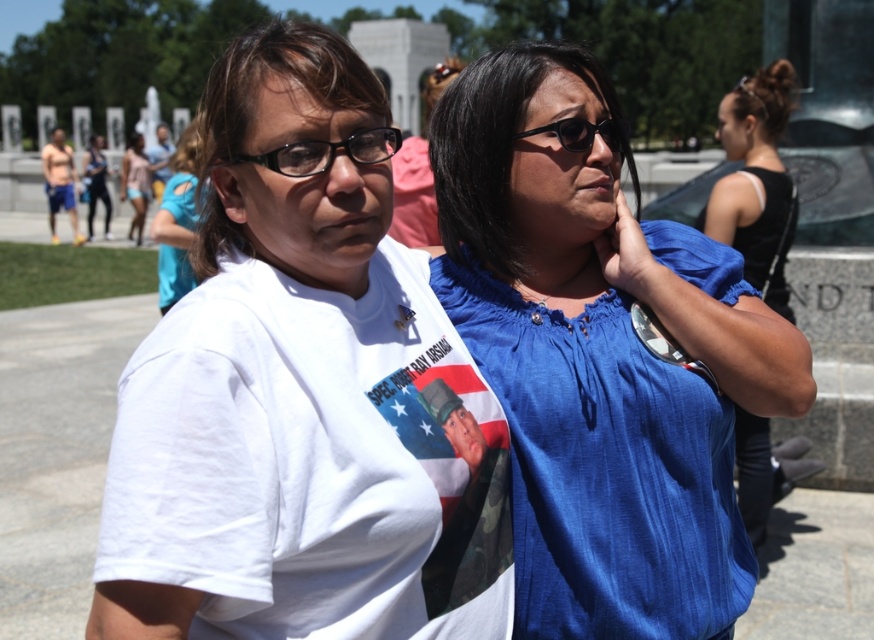
Question: Is blue fabric shirt at right closer to the viewer compared to black plastic sunglasses at center?

Choices:
 (A) no
 (B) yes

Answer: (A)

Question: Which of the following is the closest to the observer?

Choices:
 (A) (741, 204)
 (B) (51, 189)

Answer: (A)

Question: Which point is closer to the camera taking this photo?

Choices:
 (A) (517, 132)
 (B) (47, 220)

Answer: (A)

Question: Which object appears farthest from the camera in this image?

Choices:
 (A) blue cotton shirt at center
 (B) black plastic glasses at center

Answer: (A)

Question: Observing the image, what is the correct spatial positioning of blue cotton shirt at center in reference to white cotton shirt at left?

Choices:
 (A) below
 (B) above

Answer: (A)

Question: From the image, what is the correct spatial relationship of white cotton t-shirt at center in relation to black plastic sunglasses at center?

Choices:
 (A) left
 (B) right

Answer: (A)